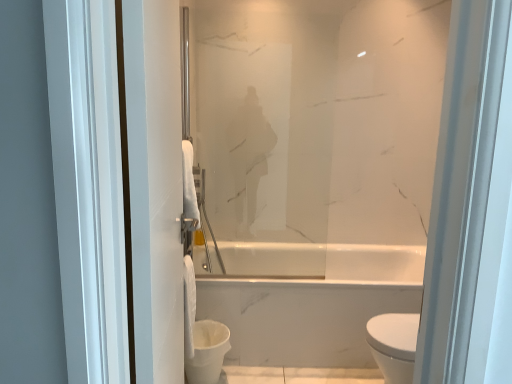
Question: Is satin glass mirror at center thinner than white fluffy toilet paper at center?

Choices:
 (A) yes
 (B) no

Answer: (A)

Question: Considering the relative positions of satin glass mirror at center and white fluffy toilet paper at center in the image provided, is satin glass mirror at center to the left of white fluffy toilet paper at center from the viewer's perspective?

Choices:
 (A) no
 (B) yes

Answer: (A)

Question: Considering the relative positions of satin glass mirror at center and white fluffy toilet paper at center in the image provided, is satin glass mirror at center to the right of white fluffy toilet paper at center from the viewer's perspective?

Choices:
 (A) yes
 (B) no

Answer: (A)

Question: Can you confirm if satin glass mirror at center is wider than white fluffy toilet paper at center?

Choices:
 (A) yes
 (B) no

Answer: (B)

Question: Is satin glass mirror at center far away from white fluffy toilet paper at center?

Choices:
 (A) no
 (B) yes

Answer: (B)

Question: From a real-world perspective, is white glossy toilet bowl at lower center positioned above or below white fluffy toilet paper at center?

Choices:
 (A) below
 (B) above

Answer: (A)

Question: Is white glossy toilet bowl at lower center spatially inside white fluffy toilet paper at center, or outside of it?

Choices:
 (A) inside
 (B) outside

Answer: (B)

Question: In terms of size, does white glossy toilet bowl at lower center appear bigger or smaller than white fluffy toilet paper at center?

Choices:
 (A) small
 (B) big

Answer: (B)

Question: Visually, is white glossy toilet bowl at lower center positioned to the left or to the right of white fluffy toilet paper at center?

Choices:
 (A) left
 (B) right

Answer: (B)

Question: Considering their positions, is white fluffy toilet paper at center located in front of or behind white matte towel at left?

Choices:
 (A) front
 (B) behind

Answer: (B)

Question: Based on their positions, is white fluffy toilet paper at center located to the left or right of white matte towel at left?

Choices:
 (A) right
 (B) left

Answer: (B)

Question: From the image's perspective, is white fluffy toilet paper at center above or below white matte towel at left?

Choices:
 (A) below
 (B) above

Answer: (A)

Question: Does point tap(184, 258) appear closer or farther from the camera than point tap(164, 246)?

Choices:
 (A) closer
 (B) farther

Answer: (B)

Question: From the image's perspective, relative to satin glass mirror at center, is white glossy toilet bowl at lower center above or below?

Choices:
 (A) below
 (B) above

Answer: (A)

Question: From a real-world perspective, is white glossy toilet bowl at lower center positioned above or below satin glass mirror at center?

Choices:
 (A) below
 (B) above

Answer: (A)